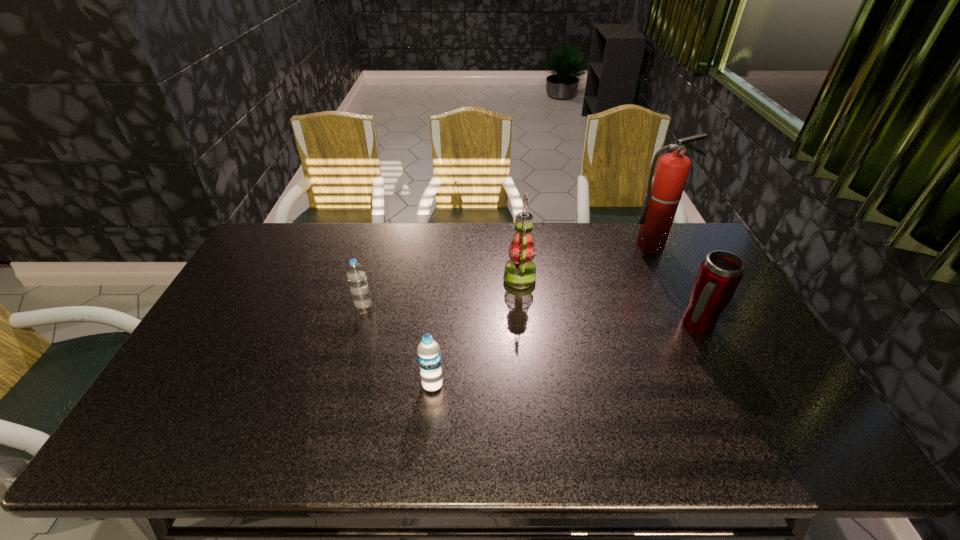
I want to click on vacant region at the left edge of the desktop, so click(241, 301).

The width and height of the screenshot is (960, 540). Find the location of `free space at the far right corner of the desktop`. free space at the far right corner of the desktop is located at coordinates (682, 253).

Where is `free space between the fire extinguisher and the second farthest object`? free space between the fire extinguisher and the second farthest object is located at coordinates (586, 261).

At what (x,y) coordinates should I click in order to perform the action: click on free space between the third shortest object and the nearer water bottle. Please return your answer as a coordinate pair (x, y). Looking at the image, I should click on (564, 356).

I want to click on blank region between the third shortest object and the farther water bottle, so click(531, 318).

Locate an element on the screen. This screenshot has height=540, width=960. vacant space in between the left water bottle and the third tallest object is located at coordinates (531, 318).

Image resolution: width=960 pixels, height=540 pixels. In order to click on vacant area between the tallest object and the oil lamp in this screenshot , I will do `click(586, 261)`.

Identify the location of vacant point located between the oil lamp and the fourth object from right to left. (476, 332).

Find the location of a particular element. The height and width of the screenshot is (540, 960). free spot between the right water bottle and the farthest object is located at coordinates (542, 315).

Where is `free spot between the third tallest object and the farthest object`? free spot between the third tallest object and the farthest object is located at coordinates (674, 286).